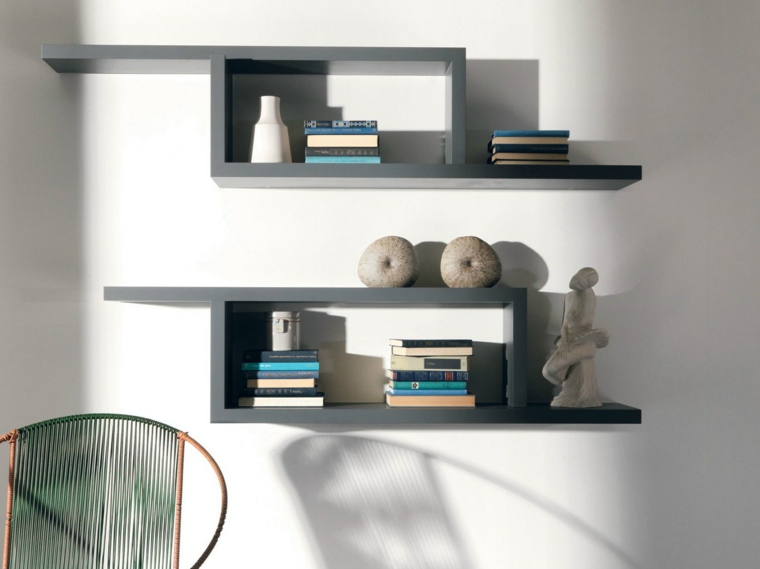
Locate an element on the screen. Image resolution: width=760 pixels, height=569 pixels. books on left side of bottom shelf is located at coordinates 280,399, 268,394, 270,385, 263,373, 261,366, 258,353.